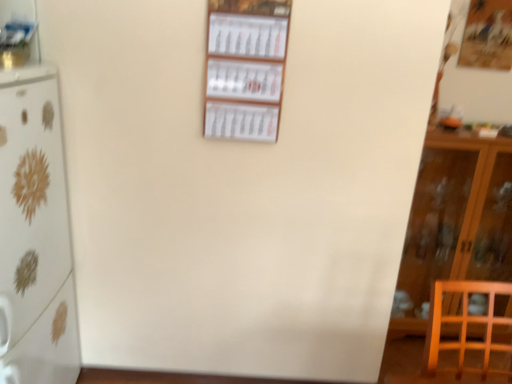
Question: Considering the positions of wooden cabinet at right and white glossy refrigerator at left in the image, is wooden cabinet at right wider or thinner than white glossy refrigerator at left?

Choices:
 (A) wide
 (B) thin

Answer: (B)

Question: Is wooden cabinet at right spatially inside white glossy refrigerator at left, or outside of it?

Choices:
 (A) inside
 (B) outside

Answer: (B)

Question: Estimate the real-world distances between objects in this image. Which object is farther from the wooden cabinet at right?

Choices:
 (A) metallic silver shelf at upper left, the first shelf viewed from the left
 (B) white glossy refrigerator at left
 (C) white paper calendar at center, which is the 2th shelf in left-to-right order

Answer: (A)

Question: Which object is the farthest from the metallic silver shelf at upper left, which is the 2th shelf from right to left?

Choices:
 (A) white glossy refrigerator at left
 (B) white paper calendar at center, the first shelf viewed from the right
 (C) wooden cabinet at right

Answer: (C)